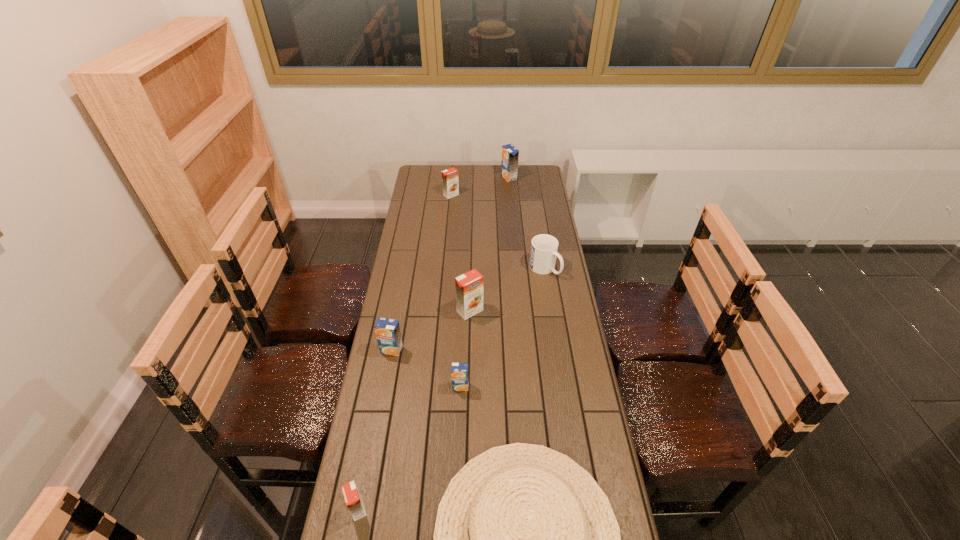
Identify the location of the nearest blue orange_juice. (459, 371).

Where is `the third nearest object`? the third nearest object is located at coordinates (459, 371).

What are the coordinates of `the nearest orange juice` in the screenshot? It's located at (354, 503).

Where is `the nearest orange orange juice`? The width and height of the screenshot is (960, 540). the nearest orange orange juice is located at coordinates (354, 503).

Where is `vacant space located on the left of the biggest blue orange_juice`? vacant space located on the left of the biggest blue orange_juice is located at coordinates (443, 178).

The width and height of the screenshot is (960, 540). I want to click on vacant area situated 0.240m on the left of the fourth farthest object, so click(396, 311).

You are a GUI agent. You are given a task and a screenshot of the screen. Output one action in this format:
    pyautogui.click(x=<x>, y=<y>)
    Task: Click on the blank space located on the left of the fifth nearest orange juice
    The height and width of the screenshot is (540, 960).
    Given the screenshot: What is the action you would take?
    pyautogui.click(x=411, y=195)

This screenshot has height=540, width=960. I want to click on vacant space located 0.210m on the back of the fourth farthest orange juice, so click(x=400, y=302).

Find the location of a particular element. Image resolution: width=960 pixels, height=540 pixels. vacant position located 0.280m on the back of the sixth nearest object is located at coordinates 537,221.

This screenshot has width=960, height=540. In order to click on vacant region located 0.110m on the right of the smallest blue orange_juice in this screenshot , I will do `click(501, 387)`.